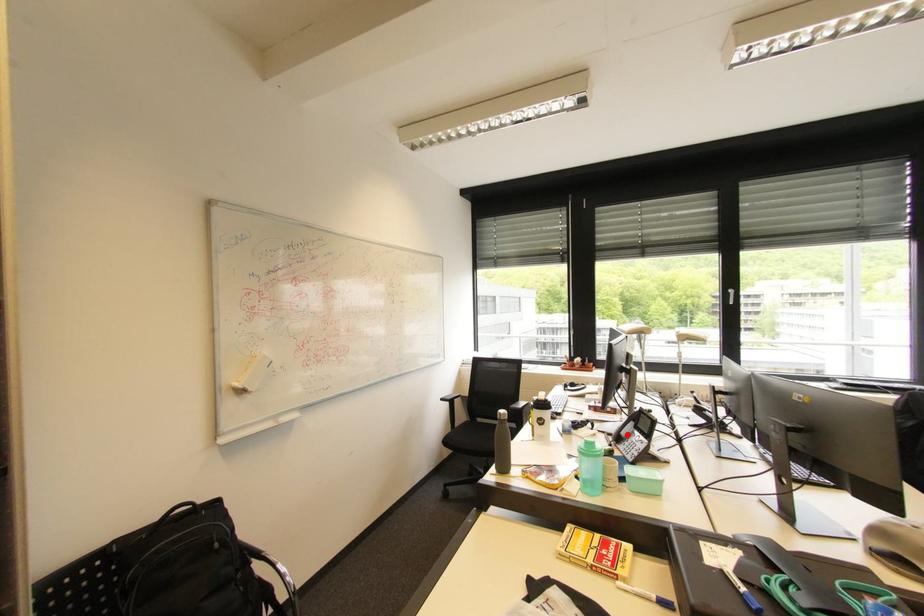
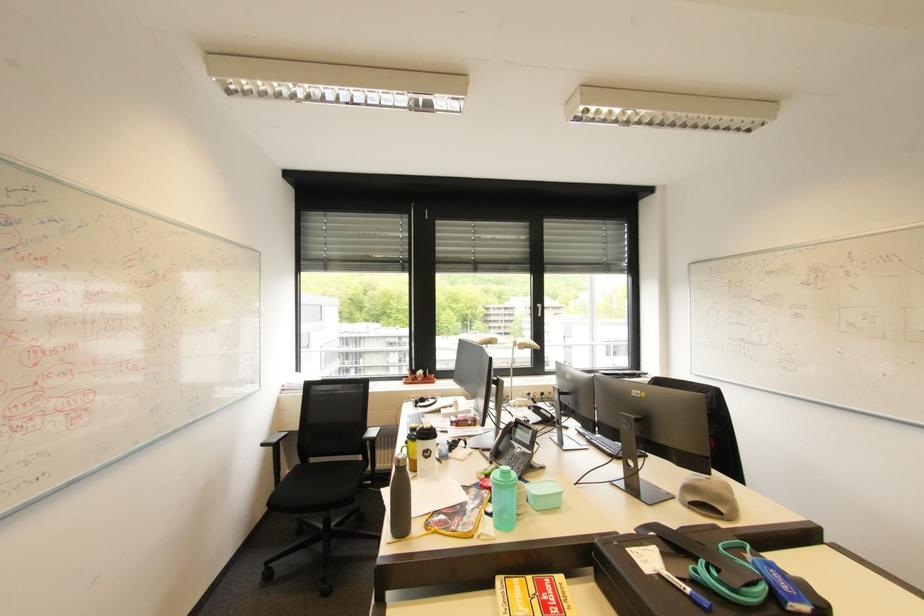
The point at the highlighted location is marked in the first image. Where is the corresponding point in the second image?

(505, 448)